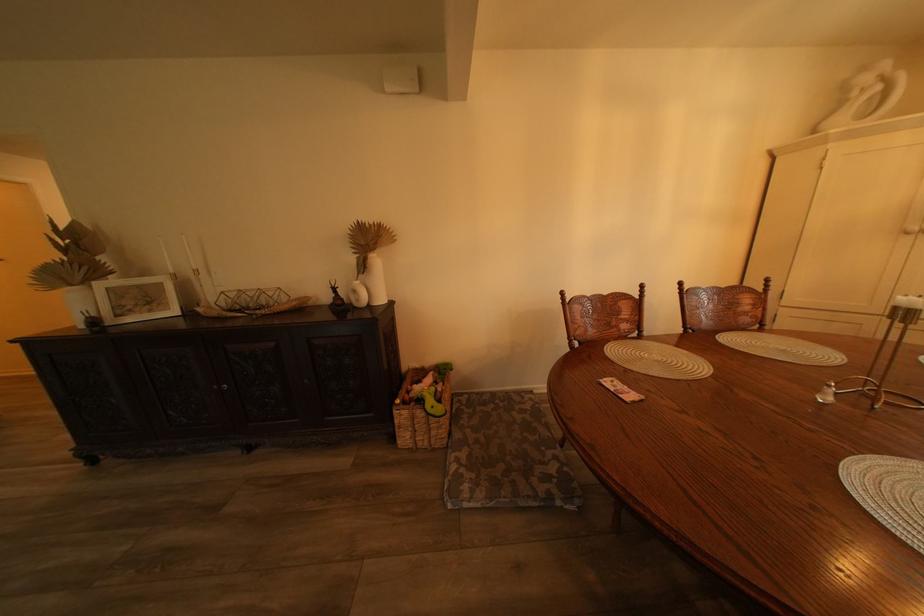
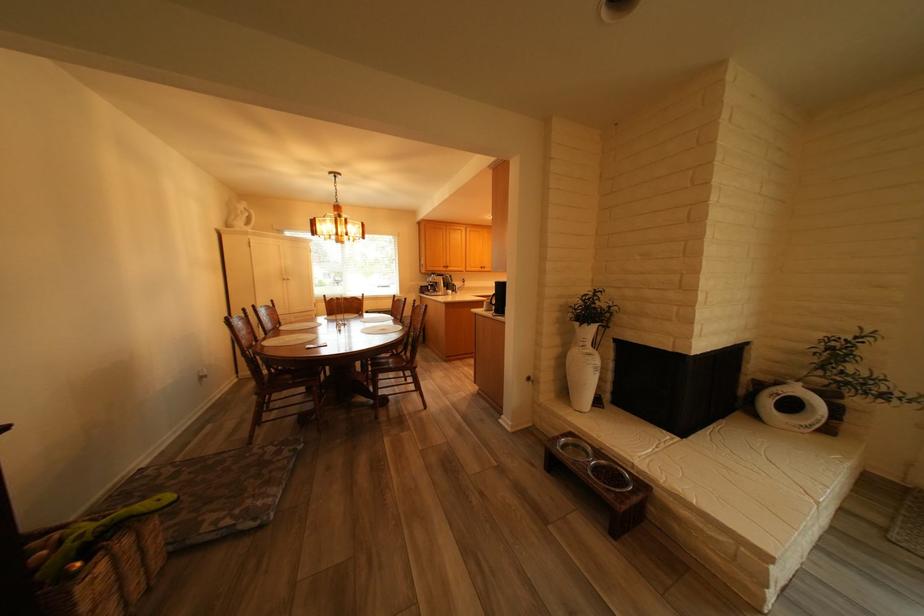
Where in the second image is the point corresponding to point 868,95 from the first image?

(253, 213)